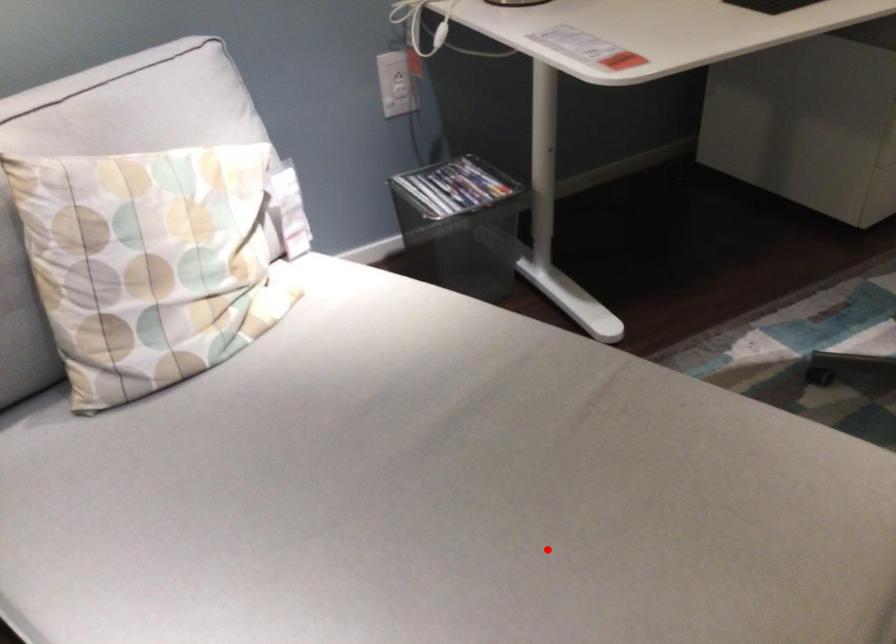
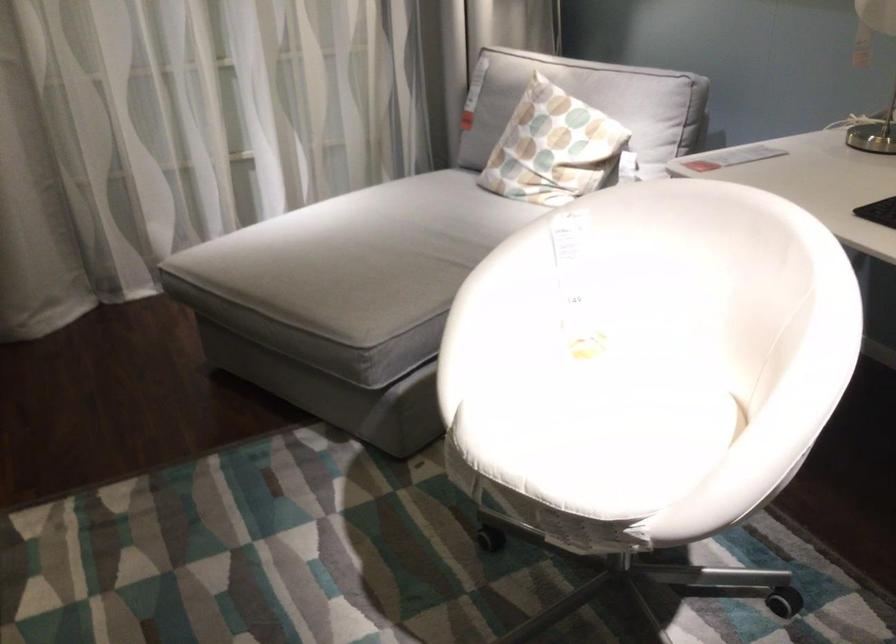
Question: I am providing you with two images of the same scene from different viewpoints. A red point is shown in image1. For the corresponding object point in image2, is it positioned nearer or farther from the camera?

Choices:
 (A) Nearer
 (B) Farther

Answer: (B)